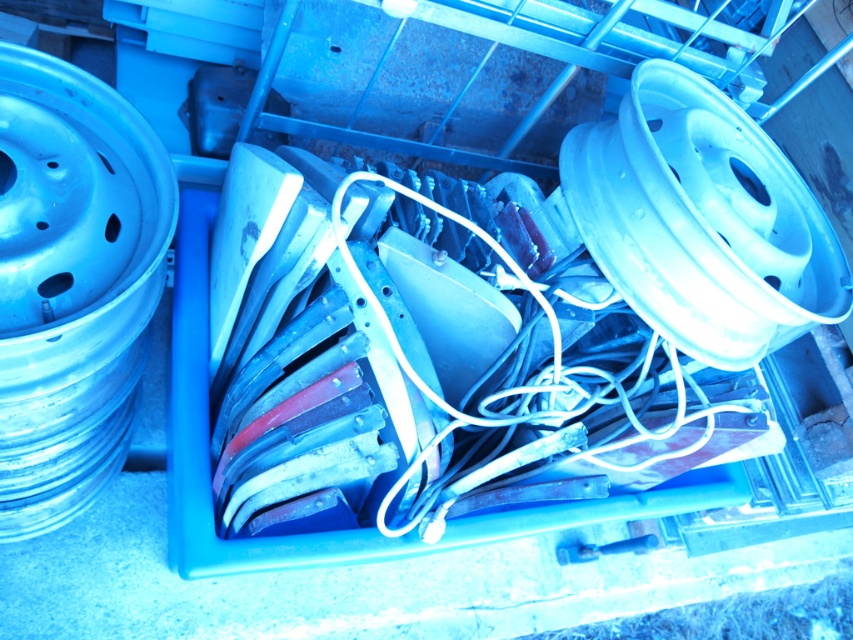
Question: Which point appears farthest from the camera in this image?

Choices:
 (A) (22, 74)
 (B) (706, 148)

Answer: (B)

Question: Can you confirm if metallic silver rim at upper right is bigger than blue metallic rim at left?

Choices:
 (A) yes
 (B) no

Answer: (A)

Question: Which of the following is the farthest from the observer?

Choices:
 (A) (68, 77)
 (B) (712, 113)

Answer: (B)

Question: Which of the following is the closest to the observer?

Choices:
 (A) blue metallic rim at left
 (B) metallic silver rim at upper right

Answer: (A)

Question: Is metallic silver rim at upper right bigger than blue metallic rim at left?

Choices:
 (A) no
 (B) yes

Answer: (B)

Question: Does metallic silver rim at upper right appear over blue metallic rim at left?

Choices:
 (A) no
 (B) yes

Answer: (B)